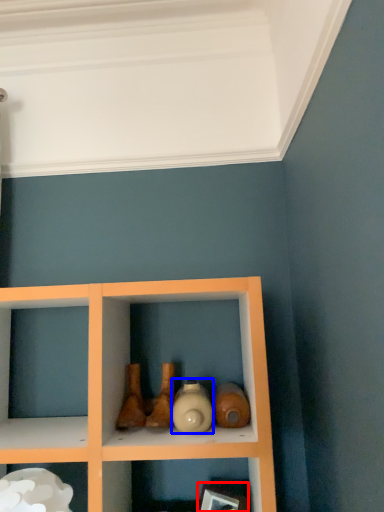
Question: Which of the following is the closest to the observer, picture frame (highlighted by a red box) or bottle (highlighted by a blue box)?

Choices:
 (A) picture frame
 (B) bottle

Answer: (B)